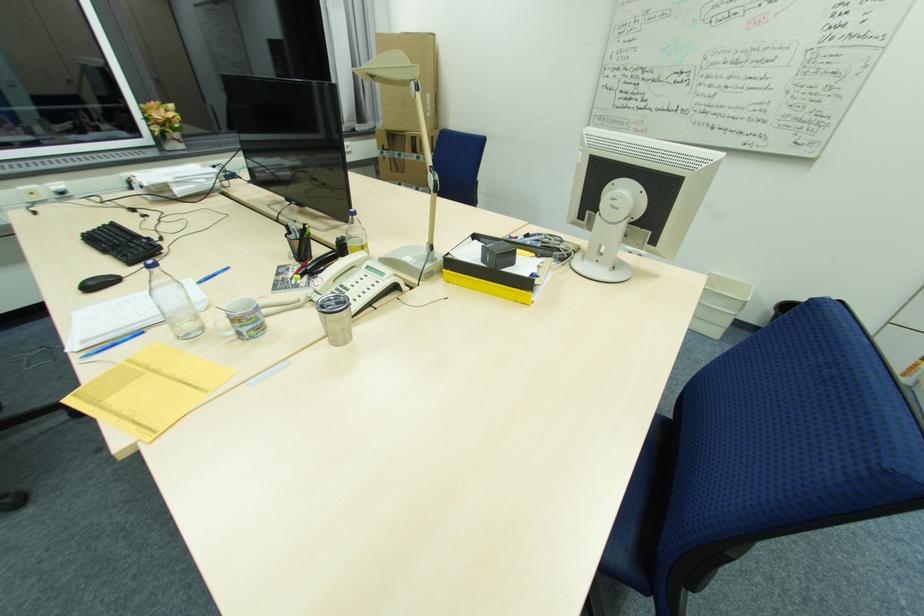
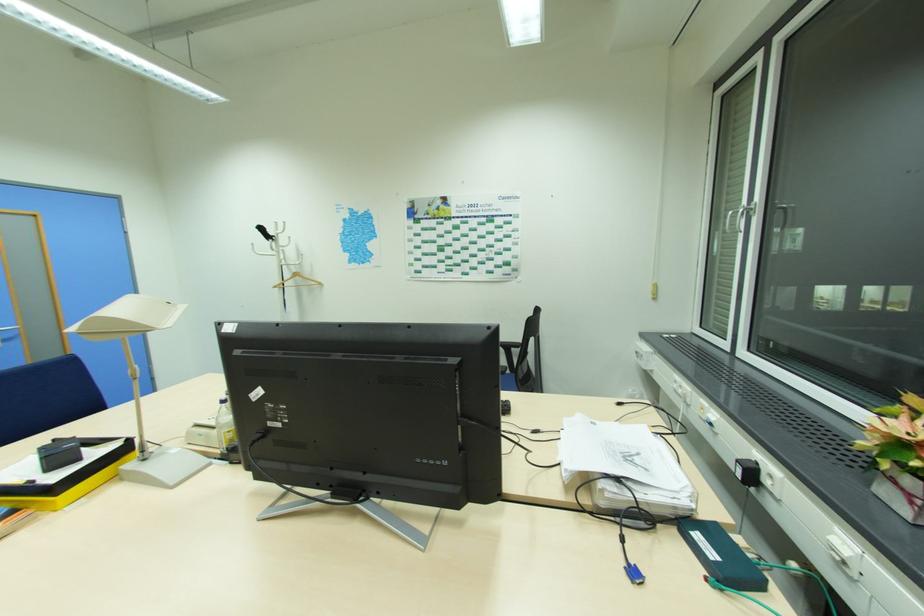
In the second image, find the point that corresponds to [178,136] in the first image.

(912, 484)